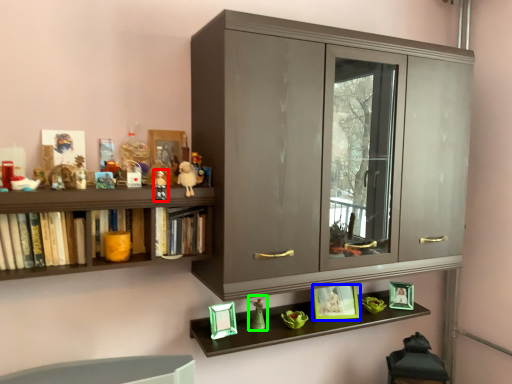
Question: Considering the real-world distances, which object is farthest from toy (highlighted by a red box)? picture frame (highlighted by a blue box) or toy (highlighted by a green box)?

Choices:
 (A) picture frame
 (B) toy

Answer: (A)